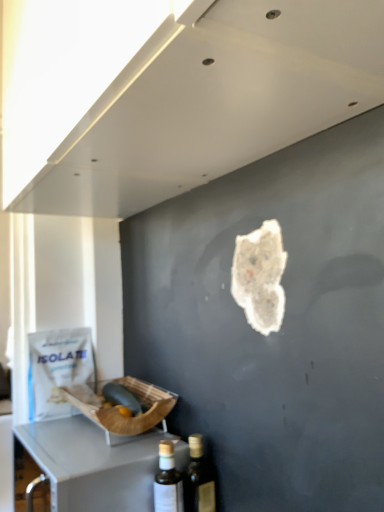
You are a GUI agent. You are given a task and a screenshot of the screen. Output one action in this format:
    pyautogui.click(x=<x>, y=<y>)
    Task: Click on the vacant space situated above matte gray desk at lower left (from a real-world perspective)
    The width and height of the screenshot is (384, 512).
    Given the screenshot: What is the action you would take?
    pyautogui.click(x=80, y=442)